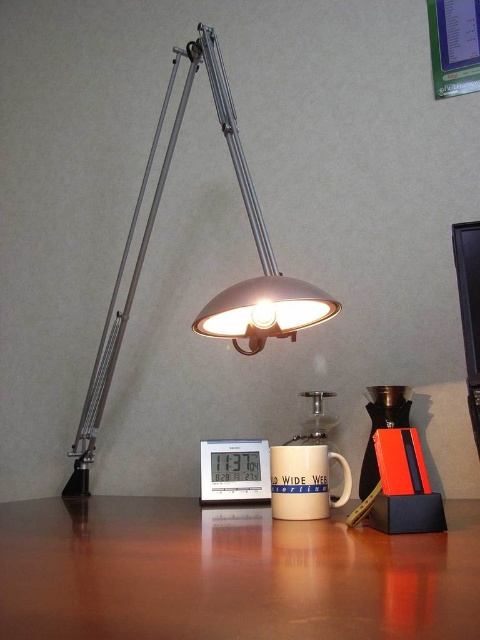
Question: Observing the image, what is the correct spatial positioning of metallic desk lamp at upper left in reference to black glossy monitor at upper right?

Choices:
 (A) right
 (B) left

Answer: (B)

Question: Does metallic desk lamp at upper left have a lesser width compared to white matte mug at center?

Choices:
 (A) no
 (B) yes

Answer: (A)

Question: Which point appears closest to the camera in this image?

Choices:
 (A) (287, 452)
 (B) (243, 285)
 (C) (113, 547)

Answer: (C)

Question: Considering the real-world distances, which object is closest to the white plastic digital clock at center?

Choices:
 (A) white matte mug at center
 (B) metallic desk lamp at upper left
 (C) black glossy monitor at upper right

Answer: (A)

Question: Which object is the farthest from the white plastic digital clock at center?

Choices:
 (A) metallic desk lamp at upper left
 (B) black glossy monitor at upper right
 (C) brown wooden table at center

Answer: (B)

Question: Can you confirm if brown wooden table at center is smaller than metallic desk lamp at upper left?

Choices:
 (A) no
 (B) yes

Answer: (B)